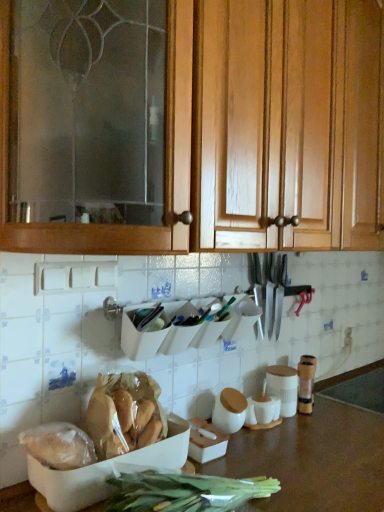
Question: From the image's perspective, is brown matte countertop at lower center on top of translucent plastic bag of bread at lower left, the second food in the left-to-right sequence?

Choices:
 (A) no
 (B) yes

Answer: (A)

Question: Considering the relative sizes of brown matte countertop at lower center and translucent plastic bag of bread at lower left, the 1th food in the right-to-left sequence, in the image provided, is brown matte countertop at lower center bigger than translucent plastic bag of bread at lower left, the 1th food in the right-to-left sequence,?

Choices:
 (A) no
 (B) yes

Answer: (B)

Question: Is brown matte countertop at lower center positioned behind translucent plastic bag of bread at lower left, the 1th food in the right-to-left sequence?

Choices:
 (A) yes
 (B) no

Answer: (B)

Question: Are brown matte countertop at lower center and translucent plastic bag of bread at lower left, the second food in the left-to-right sequence, making contact?

Choices:
 (A) no
 (B) yes

Answer: (A)

Question: Is brown matte countertop at lower center turned away from translucent plastic bag of bread at lower left, the second food in the left-to-right sequence?

Choices:
 (A) no
 (B) yes

Answer: (A)

Question: Based on their sizes in the image, would you say wooden cabinet at upper center is bigger or smaller than translucent plastic bag of bread at lower left, the first food in the left-to-right sequence?

Choices:
 (A) small
 (B) big

Answer: (B)

Question: Relative to translucent plastic bag of bread at lower left, the first food in the left-to-right sequence, is wooden cabinet at upper center in front or behind?

Choices:
 (A) front
 (B) behind

Answer: (A)

Question: Do you think wooden cabinet at upper center is within translucent plastic bag of bread at lower left, the first food in the left-to-right sequence, or outside of it?

Choices:
 (A) outside
 (B) inside

Answer: (A)

Question: In terms of height, does wooden cabinet at upper center look taller or shorter compared to translucent plastic bag of bread at lower left, the 2th food from the right?

Choices:
 (A) short
 (B) tall

Answer: (B)

Question: Do you think brown matte countertop at lower center is within translucent plastic bag of bread at lower left, the 1th food in the right-to-left sequence, or outside of it?

Choices:
 (A) inside
 (B) outside

Answer: (B)

Question: In terms of height, does brown matte countertop at lower center look taller or shorter compared to translucent plastic bag of bread at lower left, the 1th food in the right-to-left sequence?

Choices:
 (A) short
 (B) tall

Answer: (B)

Question: From a real-world perspective, is brown matte countertop at lower center above or below translucent plastic bag of bread at lower left, the second food in the left-to-right sequence?

Choices:
 (A) below
 (B) above

Answer: (A)

Question: Based on their positions, is brown matte countertop at lower center located to the left or right of translucent plastic bag of bread at lower left, the 1th food in the right-to-left sequence?

Choices:
 (A) right
 (B) left

Answer: (A)

Question: Considering their positions, is polished silver knife set at center located in front of or behind translucent plastic bag of bread at lower left, the first food in the left-to-right sequence?

Choices:
 (A) behind
 (B) front

Answer: (A)

Question: From a real-world perspective, relative to translucent plastic bag of bread at lower left, the 2th food from the right, is polished silver knife set at center vertically above or below?

Choices:
 (A) below
 (B) above

Answer: (B)